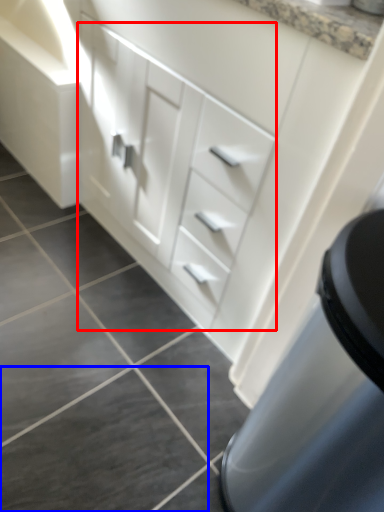
Question: Which object is closer to the camera taking this photo, drawer (highlighted by a red box) or tile (highlighted by a blue box)?

Choices:
 (A) drawer
 (B) tile

Answer: (A)